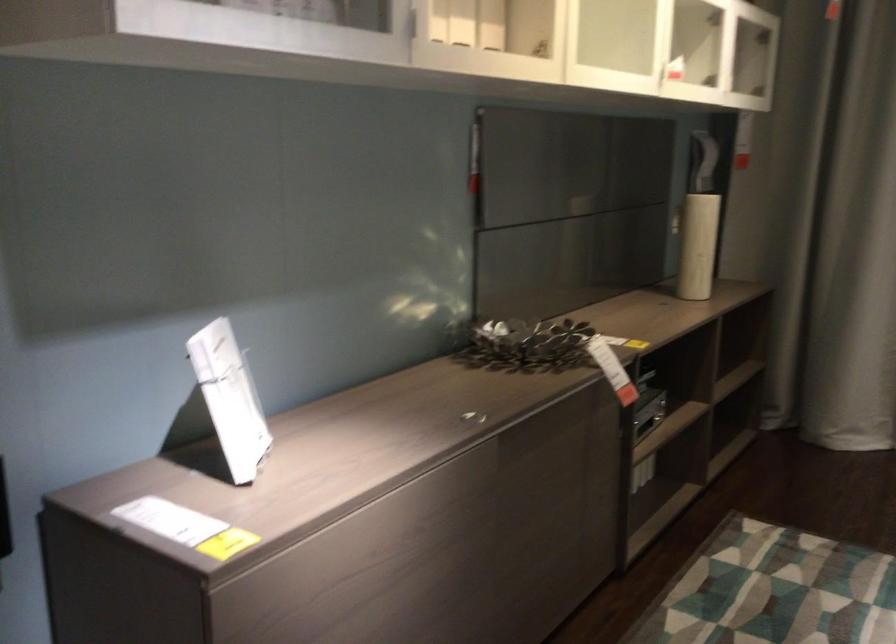
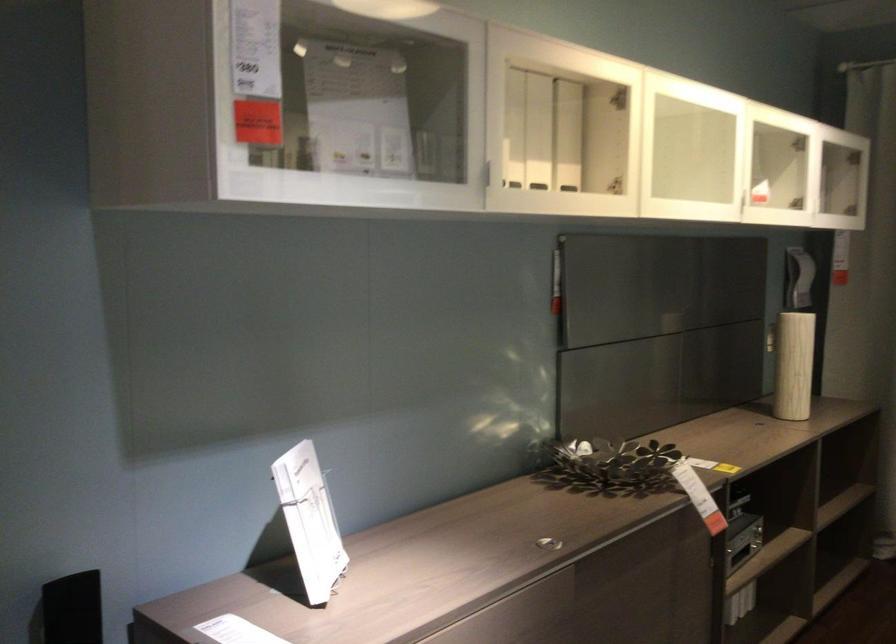
The point at (472, 415) is marked in the first image. Where is the corresponding point in the second image?

(547, 543)